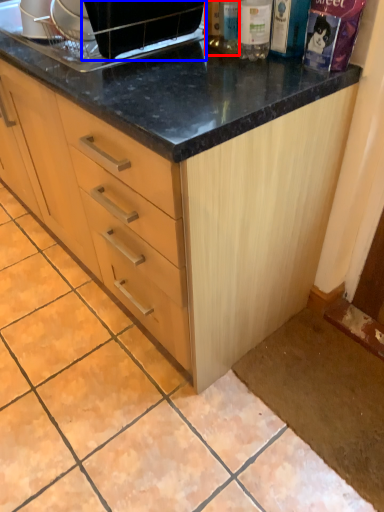
Question: Which object is closer to the camera taking this photo, bottle (highlighted by a red box) or appliance (highlighted by a blue box)?

Choices:
 (A) bottle
 (B) appliance

Answer: (B)